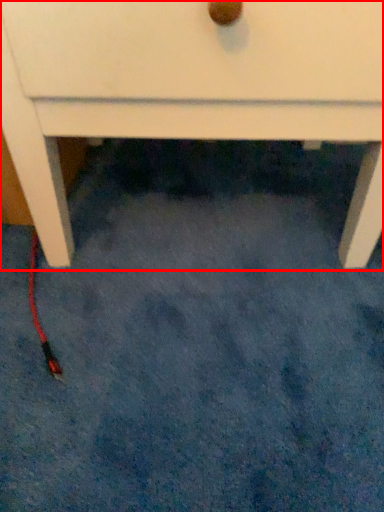
Question: Observing the image, what is the correct spatial positioning of chest of drawers (annotated by the red box) in reference to cable?

Choices:
 (A) left
 (B) right

Answer: (B)